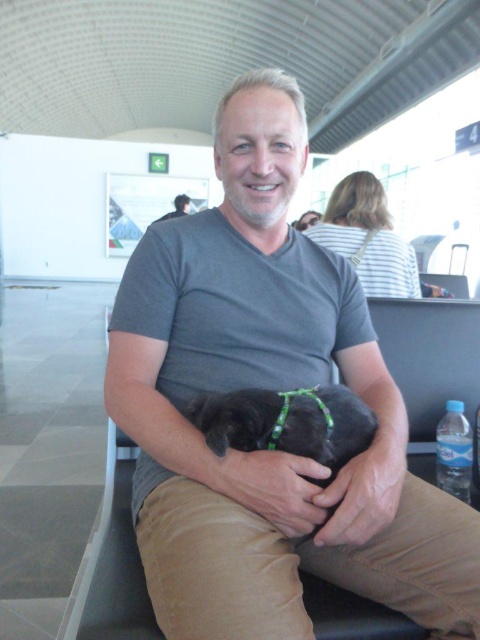
You are at the airport and want to go to the gate. You see two points in the image, one at point (222, 269) and another at point (361, 444). According to their positions, which point is closer to the direction the green arrow sign is pointing to?

Point (361, 444) is closer to the direction the green arrow sign is pointing to because it is in front of point (222, 269), which is behind it.

You are a fashion designer observing a man in an airport waiting area. He is wearing two gray shirts, the gray cotton shirt at center and the matte gray shirt at center. Which one appears bigger in size?

The gray cotton shirt at center has a larger size compared to the matte gray shirt at center, so the gray cotton shirt at center appears bigger.